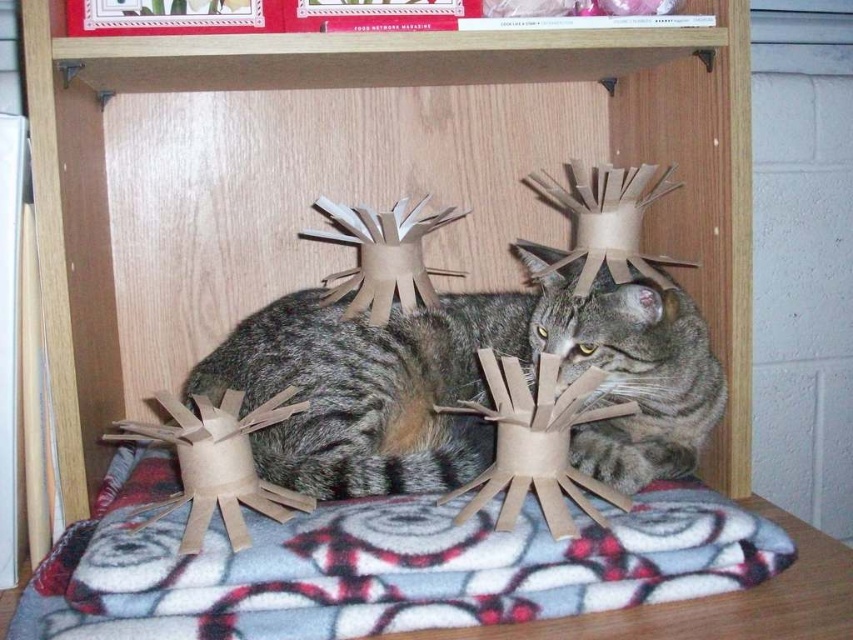
Question: Does tabby fur cat at center appear on the right side of tabby fur cat head at center?

Choices:
 (A) yes
 (B) no

Answer: (B)

Question: Is tabby fur cat at center to the left of tabby fur cat head at center from the viewer's perspective?

Choices:
 (A) no
 (B) yes

Answer: (B)

Question: Which point is farther to the camera?

Choices:
 (A) (527, 323)
 (B) (212, 368)

Answer: (A)

Question: Which object is farther from the camera taking this photo?

Choices:
 (A) tabby fur cat at center
 (B) tabby fur cat head at center

Answer: (B)

Question: Does tabby fur cat at center appear on the left side of tabby fur cat head at center?

Choices:
 (A) no
 (B) yes

Answer: (B)